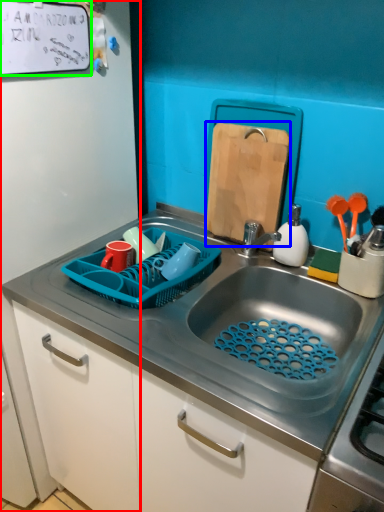
Question: Which object is positioned farthest from side (highlighted by a red box)? Select from cutting board (highlighted by a blue box) and bulletin board (highlighted by a green box).

Choices:
 (A) cutting board
 (B) bulletin board

Answer: (A)